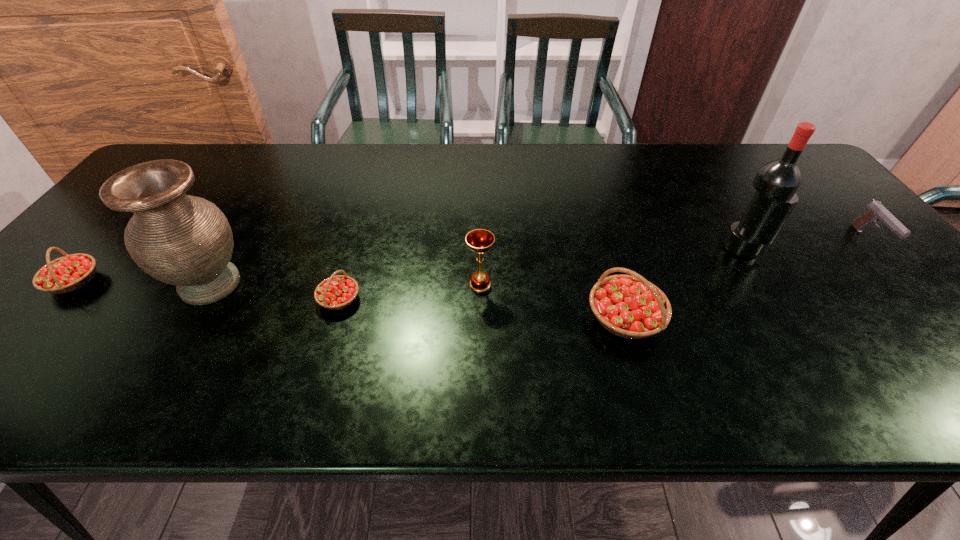
At what (x,y) coordinates should I click in order to perform the action: click on the second tallest strawberry. Please return your answer as a coordinate pair (x, y). This screenshot has width=960, height=540. Looking at the image, I should click on (66, 274).

Locate an element on the screen. The image size is (960, 540). the leftmost object is located at coordinates (66, 274).

The image size is (960, 540). What are the coordinates of `the shortest object` in the screenshot? It's located at (336, 292).

The height and width of the screenshot is (540, 960). What are the coordinates of `the second strawberry from left to right` in the screenshot? It's located at (336, 292).

Find the location of a particular element. This screenshot has height=540, width=960. the tallest strawberry is located at coordinates (628, 306).

I want to click on the third object from right to left, so click(x=628, y=306).

The height and width of the screenshot is (540, 960). I want to click on wine bottle, so click(x=776, y=182).

You are a GUI agent. You are given a task and a screenshot of the screen. Output one action in this format:
    pyautogui.click(x=<x>, y=<y>)
    Task: Click on the chalice
    
    Given the screenshot: What is the action you would take?
    pyautogui.click(x=479, y=240)

Locate an element on the screen. This screenshot has height=540, width=960. pistol is located at coordinates (875, 211).

The width and height of the screenshot is (960, 540). I want to click on vase, so click(182, 240).